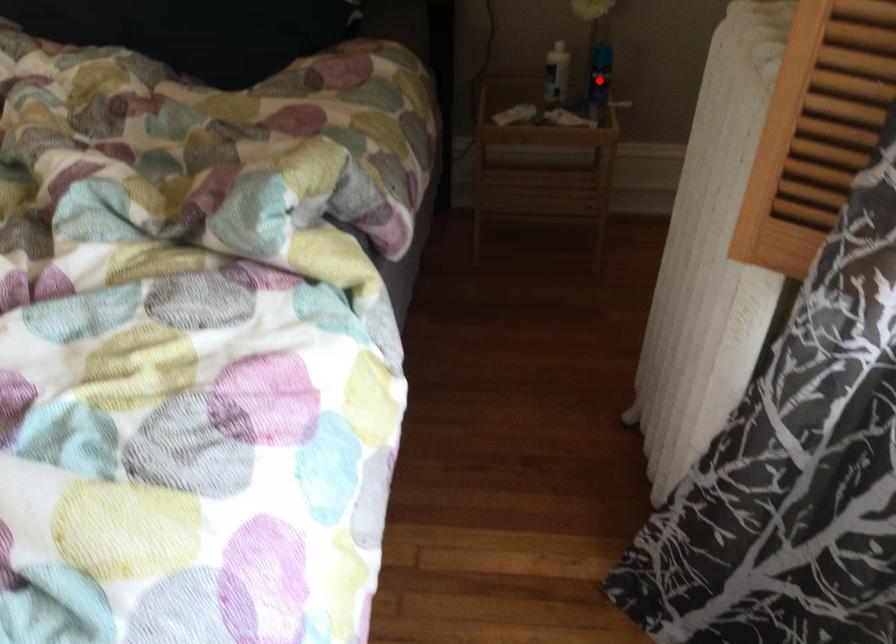
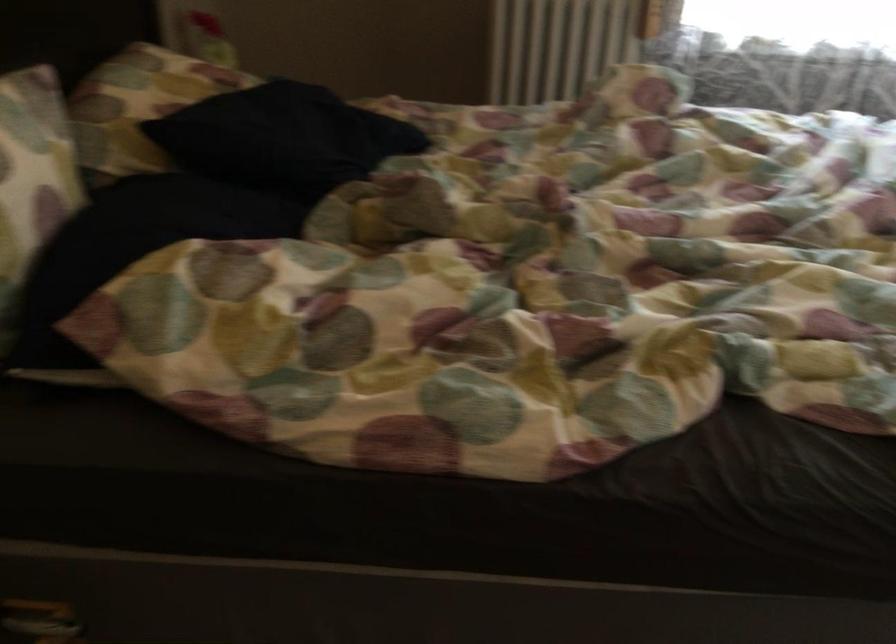
Question: I am providing you with two images of the same scene from different viewpoints. A red point is marked on the first image. At the location where the point appears in image 1, is it still visible in image 2?

Choices:
 (A) Yes
 (B) No

Answer: (B)